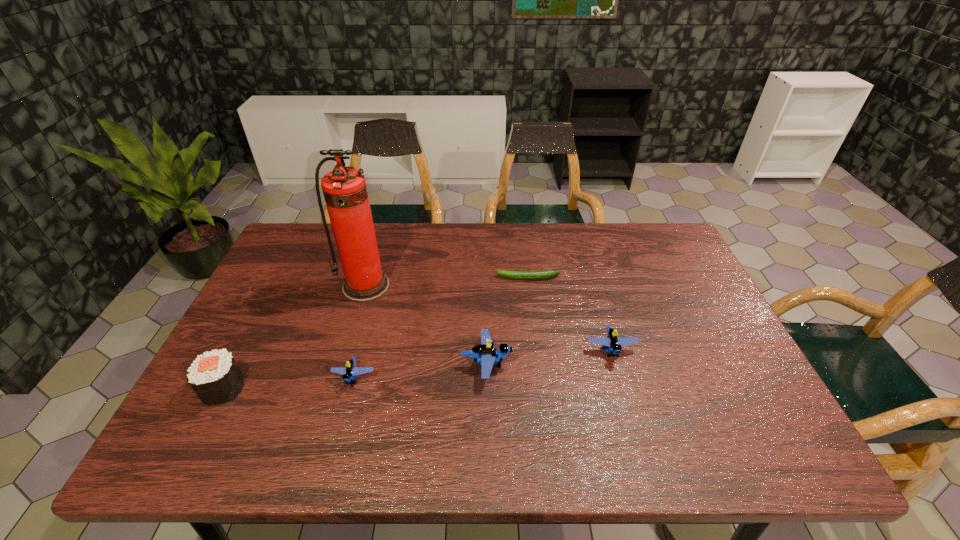
The Legos are evenly distributed in the image. To maintain this, where would you place another Lego on the right? Please point to a free space. Please provide its 2D coordinates. Your answer should be formatted as a tuple, i.e. [(x, y)], where the tuple contains the x and y coordinates of a point satisfying the conditions above.

[(729, 338)]